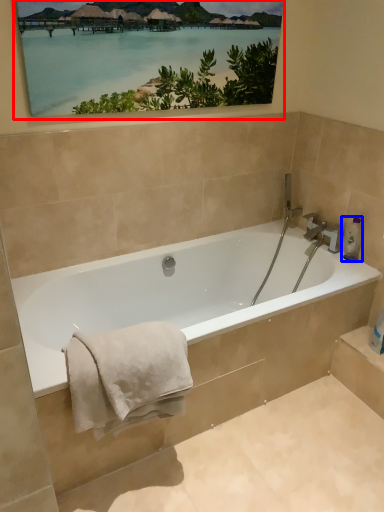
Question: Which point is further to the camera, picture frame (highlighted by a red box) or toiletry (highlighted by a blue box)?

Choices:
 (A) picture frame
 (B) toiletry

Answer: (B)